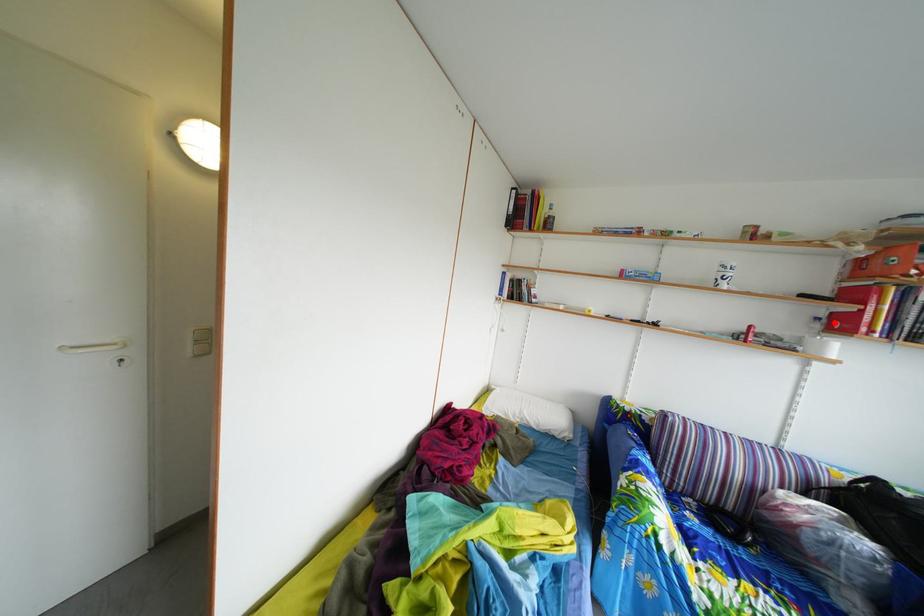
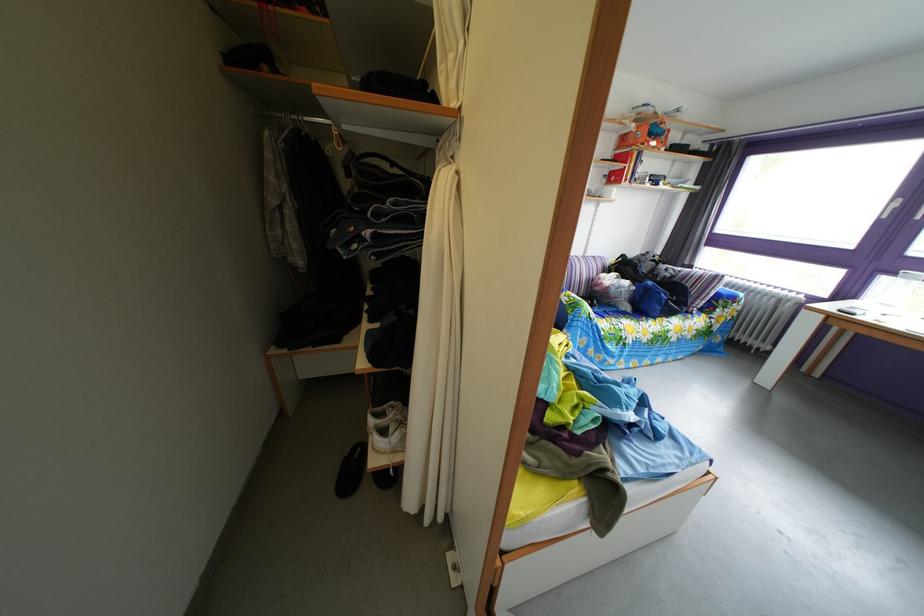
The point at the highlighted location is marked in the first image. Where is the corresponding point in the second image?

(618, 180)